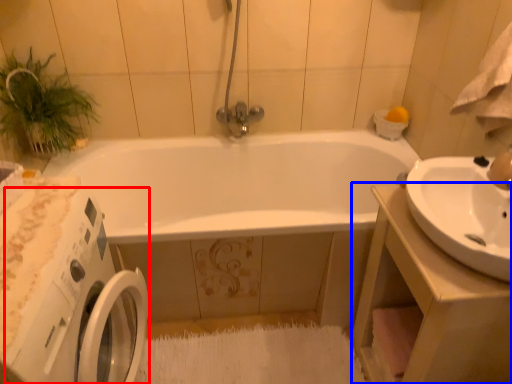
Question: Which object is further to the camera taking this photo, washing machine (highlighted by a red box) or counter top (highlighted by a blue box)?

Choices:
 (A) washing machine
 (B) counter top

Answer: (B)